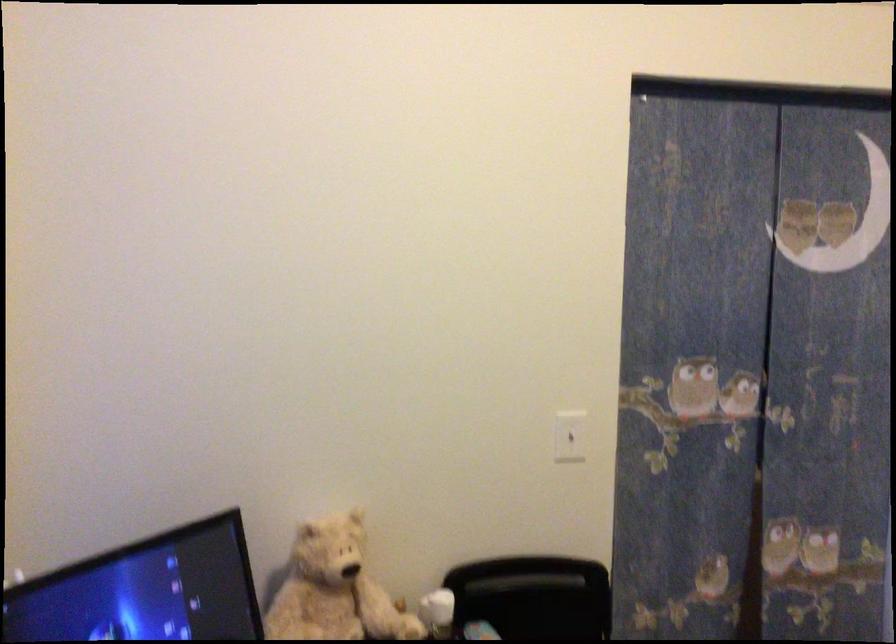
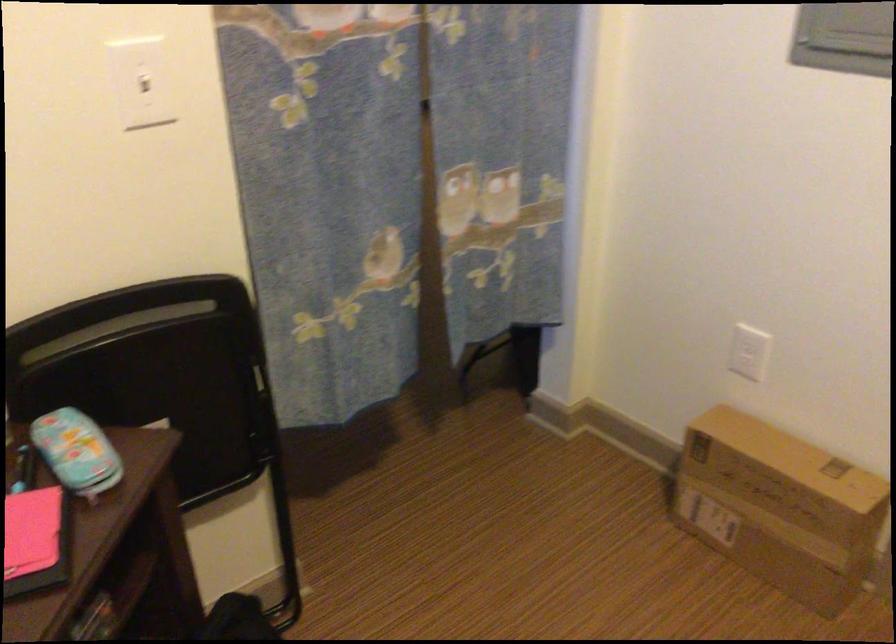
How did the camera likely rotate?

The camera rotated toward right-down.